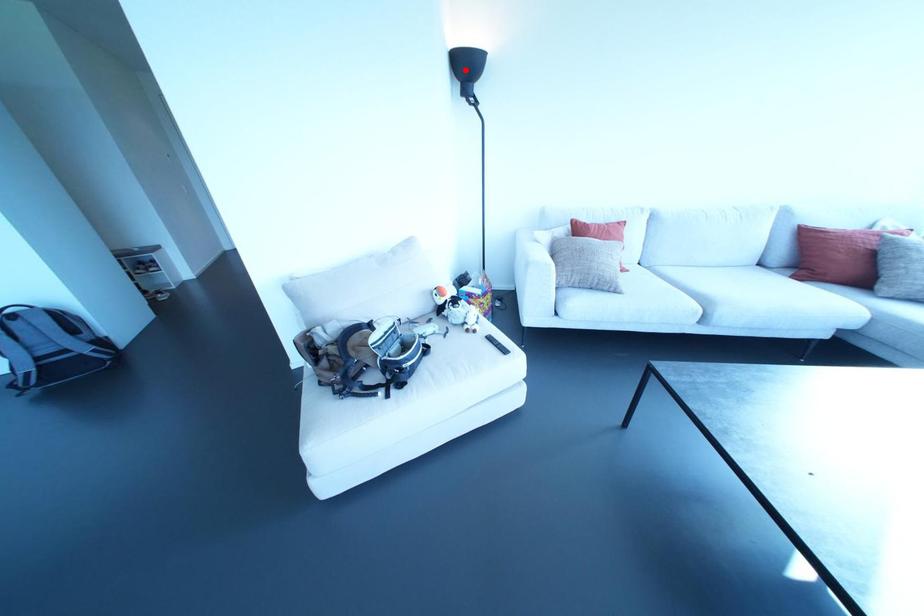
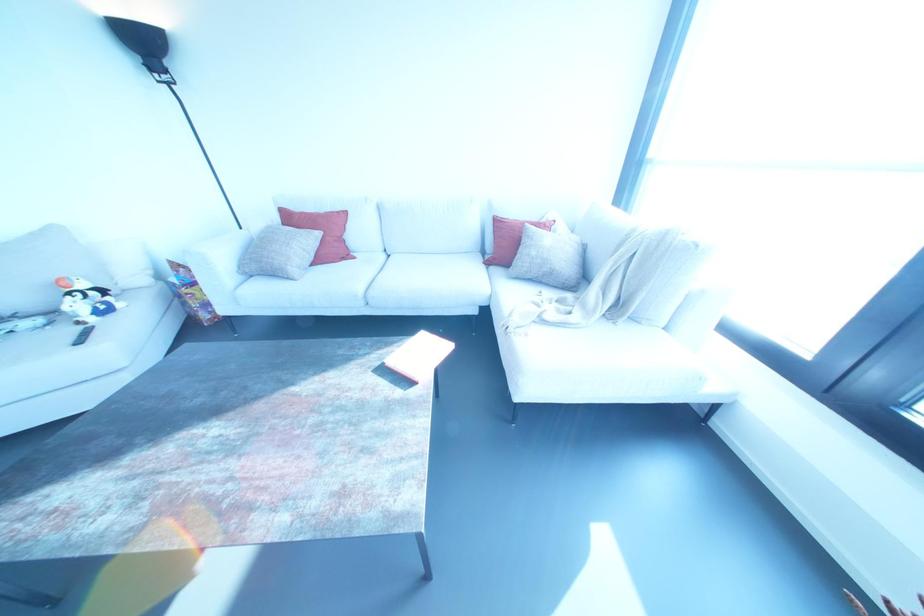
Question: I am providing you with two images of the same scene from different viewpoints. In image1, a red point is highlighted. Considering the same 3D point in image2, which of the following is correct?

Choices:
 (A) It is closer
 (B) It is farther

Answer: (B)